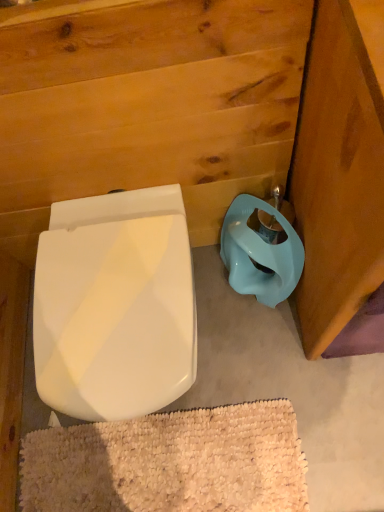
This screenshot has width=384, height=512. In order to click on empty space that is ontop of white glossy toilet seat at lower left in this screenshot , I will do `click(113, 297)`.